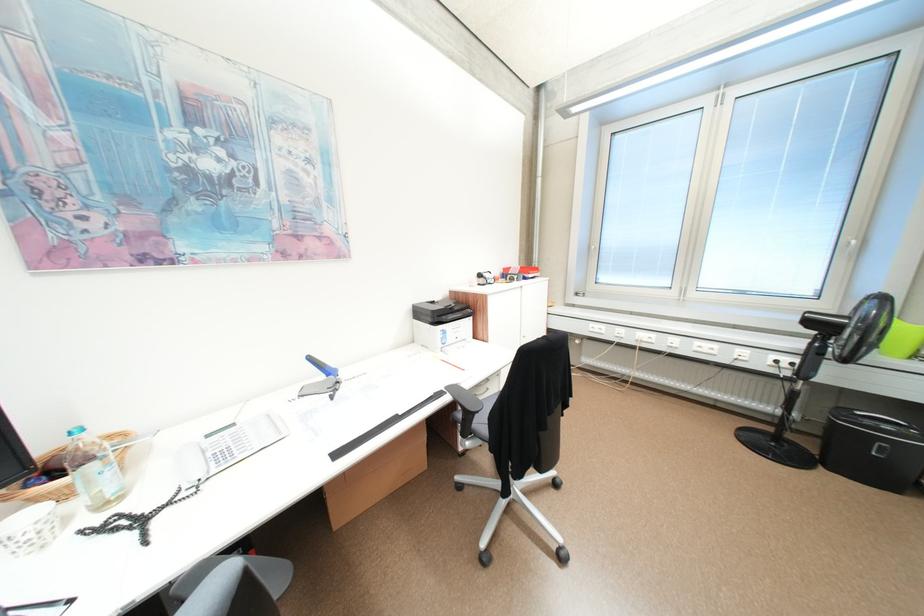
Where would you push the fan buttons? Please return your answer as a coordinate pair (x, y).

(821, 349)